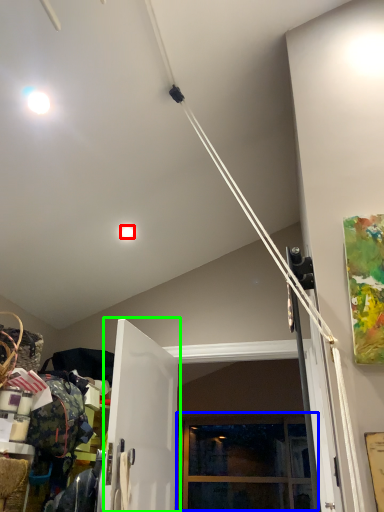
Question: Which object is positioned farthest from droplight (highlighted by a red box)? Select from window (highlighted by a blue box) and door (highlighted by a green box).

Choices:
 (A) window
 (B) door

Answer: (A)